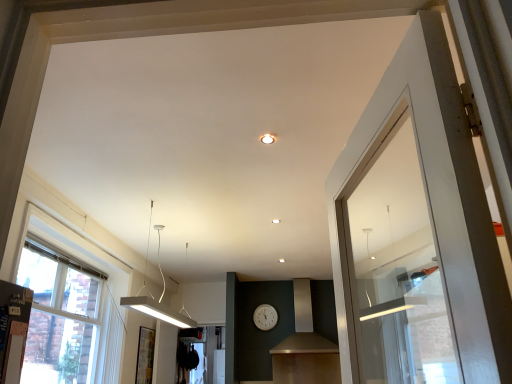
Question: Is matte black vent at center wider or thinner than white plastic clock at center?

Choices:
 (A) thin
 (B) wide

Answer: (B)

Question: From the image's perspective, is matte black vent at center positioned above or below white plastic clock at center?

Choices:
 (A) above
 (B) below

Answer: (A)

Question: Which is farther from the white matte rectangular light fixture at left?

Choices:
 (A) matte black vent at center
 (B) white plastic clock at center
 (C) matte white ceiling light at center
 (D) white wood window at left

Answer: (C)

Question: Which object is positioned farthest from the white plastic clock at center?

Choices:
 (A) white matte rectangular light fixture at left
 (B) matte black vent at center
 (C) white wood window at left
 (D) matte white ceiling light at center

Answer: (D)